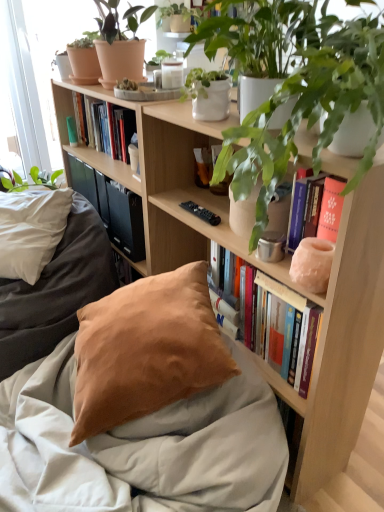
You are a GUI agent. You are given a task and a screenshot of the screen. Output one action in this format:
    pyautogui.click(x=<x>, y=<y>)
    Task: Click on the satin beige pillow at lower center
    Image resolution: width=384 pixels, height=512 pixels.
    Given the screenshot: What is the action you would take?
    pyautogui.click(x=140, y=447)

Where is `wooden bookcase at center`? The height and width of the screenshot is (512, 384). wooden bookcase at center is located at coordinates (343, 342).

The height and width of the screenshot is (512, 384). What do you see at coordinates (56, 291) in the screenshot? I see `suede pillow at lower left` at bounding box center [56, 291].

Image resolution: width=384 pixels, height=512 pixels. What are the coordinates of `green matte plant at upper right, the 1th houseplant positioned from the right` in the screenshot? It's located at (258, 41).

You are a GUI agent. You are given a task and a screenshot of the screen. Output one action in this format:
    pyautogui.click(x=<x>, y=<y>)
    Task: Click on the satin beige pillow at lower center
    This screenshot has width=384, height=512.
    Given the screenshot: What is the action you would take?
    pyautogui.click(x=140, y=447)

Are satin beige pillow at lower center and suede pillow at lower left beside each other?

satin beige pillow at lower center and suede pillow at lower left are clearly separated.

Considering the sizes of objects satin beige pillow at lower center and suede pillow at lower left in the image provided, who is smaller, satin beige pillow at lower center or suede pillow at lower left?

satin beige pillow at lower center.

In terms of width, does satin beige pillow at lower center look wider or thinner when compared to suede pillow at lower left?

In the image, satin beige pillow at lower center appears to be wider than suede pillow at lower left.

Between satin beige pillow at lower center and suede pillow at lower left, which one has less height?

With less height is satin beige pillow at lower center.

Is hardcover books at upper center, marked as the second book in a front-to-back arrangement, positioned beyond the bounds of matte pink stone vase at upper right, which is the 2th book in left-to-right order?

Yes, hardcover books at upper center, marked as the second book in a front-to-back arrangement, is located beyond the bounds of matte pink stone vase at upper right, which is the 2th book in left-to-right order.

Relative to matte pink stone vase at upper right, which is the 2th book in left-to-right order, is hardcover books at upper center, which ranks as the 1th book in top-to-bottom order, in front or behind?

hardcover books at upper center, which ranks as the 1th book in top-to-bottom order, is positioned farther from the viewer than matte pink stone vase at upper right, which is the 2th book in left-to-right order.

Measure the distance between hardcover books at upper center, marked as the second book in a front-to-back arrangement, and matte pink stone vase at upper right, positioned as the 2th book in back-to-front order.

hardcover books at upper center, marked as the second book in a front-to-back arrangement, and matte pink stone vase at upper right, positioned as the 2th book in back-to-front order, are 35.86 inches apart from each other.

How far apart are matte terracotta pot at upper left, the 2th houseplant positioned from the front, and green matte plant at upper right, which is the second houseplant from top to bottom?

The distance of matte terracotta pot at upper left, the 2th houseplant positioned from the front, from green matte plant at upper right, which is the second houseplant from top to bottom, is 22.04 inches.

Is point (136, 24) positioned behind point (188, 40)?

That is True.

From the image's perspective, relative to green matte plant at upper right, the 1th houseplant positioned from the right, is matte terracotta pot at upper left, the first houseplant viewed from the top, above or below?

From the image's perspective, matte terracotta pot at upper left, the first houseplant viewed from the top, appears above green matte plant at upper right, the 1th houseplant positioned from the right.

Can you confirm if matte terracotta pot at upper left, the first houseplant viewed from the top, is wider than green matte plant at upper right, arranged as the first houseplant when viewed from the front?

Yes.

Considering the positions of points (247, 23) and (107, 258), is point (247, 23) farther from camera compared to point (107, 258)?

No, (247, 23) is in front of (107, 258).

Can you confirm if green matte plant at upper right, which is the second houseplant from top to bottom, is taller than suede pillow at lower left?

No.

Considering the relative positions of green matte plant at upper right, the 1th houseplant positioned from the right, and suede pillow at lower left in the image provided, is green matte plant at upper right, the 1th houseplant positioned from the right, behind suede pillow at lower left?

No.

From the picture: Visually, is green matte plant at upper right, which is the first houseplant from bottom to top, positioned to the left or to the right of suede pillow at lower left?

From the image, it's evident that green matte plant at upper right, which is the first houseplant from bottom to top, is to the right of suede pillow at lower left.

Looking at this image, measure the distance from black matte book at center to suede pillow at lower left.

black matte book at center is 30.03 centimeters from suede pillow at lower left.

Considering the points (132, 233) and (32, 292), which point is in front, point (132, 233) or point (32, 292)?

The point (32, 292) is in front.

Between black matte book at center and suede pillow at lower left, which one has larger width?

With larger width is suede pillow at lower left.

Do you think black matte book at center is within suede pillow at lower left, or outside of it?

black matte book at center cannot be found inside suede pillow at lower left.

In the scene shown: Does green matte plant at upper right, which is the first houseplant from bottom to top, have a greater height compared to hardcover books at upper center, the second book viewed from the right?

Correct, green matte plant at upper right, which is the first houseplant from bottom to top, is much taller as hardcover books at upper center, the second book viewed from the right.

The image size is (384, 512). I want to click on the 1st houseplant positioned above the hardcover books at upper center, which is the 1th book from left to right (from a real-world perspective), so click(258, 41).

Is green matte plant at upper right, which is the second houseplant from top to bottom, positioned behind hardcover books at upper center, which is the 1th book from left to right?

No, green matte plant at upper right, which is the second houseplant from top to bottom, is closer to the camera.

Looking at this image, is hardcover books at upper center, which ranks as the 1th book in top-to-bottom order, at the back of green matte plant at upper right, which is the 2th houseplant from back to front?

That's not correct — green matte plant at upper right, which is the 2th houseplant from back to front, is not looking away from hardcover books at upper center, which ranks as the 1th book in top-to-bottom order.

Considering the sizes of objects suede pillow at lower left and matte terracotta pot at upper left, the first houseplant viewed from the top, in the image provided, who is thinner, suede pillow at lower left or matte terracotta pot at upper left, the first houseplant viewed from the top,?

With smaller width is matte terracotta pot at upper left, the first houseplant viewed from the top.

Considering the points (97, 284) and (128, 8), which point is in front, point (97, 284) or point (128, 8)?

The point (97, 284) is closer.

From the image's perspective, is suede pillow at lower left on top of matte terracotta pot at upper left, the second houseplant from the right?

No.

Based on the photo, from a real-world perspective, is suede pillow at lower left positioned over matte terracotta pot at upper left, the first houseplant viewed from the top, based on gravity?

No, from a real-world perspective, suede pillow at lower left is not above matte terracotta pot at upper left, the first houseplant viewed from the top.

This screenshot has width=384, height=512. Find the location of `blanket below the suede pillow at lower left (from a real-world perspective)`. blanket below the suede pillow at lower left (from a real-world perspective) is located at coordinates (140, 447).

Locate an element on the screen. This screenshot has height=512, width=384. book below the hardcover books at upper center, placed as the first book when sorted from back to front (from the image's perspective) is located at coordinates (281, 328).

Based on their spatial positions, is suede-like tan pillow at lower left or matte terracotta pot at upper left, the first houseplant viewed from the top, further from wooden bookcase at center?

A: matte terracotta pot at upper left, the first houseplant viewed from the top.

Estimate the real-world distances between objects in this image. Which object is further from green matte plant at upper right, which is the 2th houseplant from back to front, suede-like tan pillow at lower left or black matte book at center?

Among the two, black matte book at center is located further to green matte plant at upper right, which is the 2th houseplant from back to front.

When comparing their distances from black matte book at center, does satin beige pillow at lower center or wooden bookcase at center seem further?

satin beige pillow at lower center lies further to black matte book at center than the other object.

Based on their spatial positions, is matte pink stone vase at upper right, positioned as the 2th book in back-to-front order, or terracotta clay pot at upper left closer to black matte book at center?

Among the two, terracotta clay pot at upper left is located nearer to black matte book at center.

Which object lies nearer to the anchor point suede-like tan pillow at lower left, matte pink stone vase at upper right, which is the 2th book in left-to-right order, or terracotta clay pot at upper left?

matte pink stone vase at upper right, which is the 2th book in left-to-right order, is positioned closer to the anchor suede-like tan pillow at lower left.

Estimate the real-world distances between objects in this image. Which object is closer to green matte plant at upper right, which is the second houseplant from top to bottom, satin beige pillow at lower center or suede-like tan pillow at lower left?

suede-like tan pillow at lower left lies closer to green matte plant at upper right, which is the second houseplant from top to bottom, than the other object.

Based on their spatial positions, is matte pink stone vase at upper right, marked as the second book in a top-to-bottom arrangement, or suede pillow at lower left further from suede-like tan pillow at lower left?

suede pillow at lower left.

Estimate the real-world distances between objects in this image. Which object is closer to hardcover books at upper center, placed as the first book when sorted from back to front, suede pillow at lower left or satin beige pillow at lower center?

The object closer to hardcover books at upper center, placed as the first book when sorted from back to front, is suede pillow at lower left.

Where is `bookcase positioned between green matte plant at upper right, arranged as the first houseplant when viewed from the front, and black matte book at center from near to far`? The height and width of the screenshot is (512, 384). bookcase positioned between green matte plant at upper right, arranged as the first houseplant when viewed from the front, and black matte book at center from near to far is located at coordinates (343, 342).

You are a GUI agent. You are given a task and a screenshot of the screen. Output one action in this format:
    pyautogui.click(x=<x>, y=<y>)
    Task: Click on the flowerpot between matte terracotta pot at upper left, the 2th houseplant positioned from the bottom, and matte pink stone vase at upper right, the 1th book positioned from the front, in the up-down direction
    This screenshot has height=512, width=384.
    Given the screenshot: What is the action you would take?
    pyautogui.click(x=84, y=65)

At what (x,y) coordinates should I click in order to perform the action: click on houseplant between terracotta clay pot at upper left and suede-like tan pillow at lower left in the up-down direction. Please return your answer as a coordinate pair (x, y). Looking at the image, I should click on (258, 41).

Image resolution: width=384 pixels, height=512 pixels. In order to click on paperback book between matte terracotta pot at upper left, the 2th houseplant positioned from the front, and suede pillow at lower left, in the vertical direction in this screenshot , I will do `click(120, 216)`.